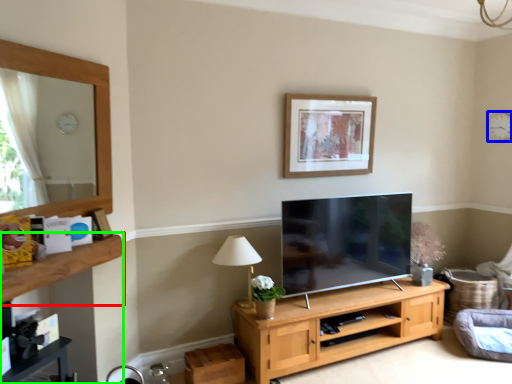
Question: Based on their relative distances, which object is nearer to shelf (highlighted by a red box)? Choose from clock (highlighted by a blue box) and dresser (highlighted by a green box).

Choices:
 (A) clock
 (B) dresser

Answer: (B)